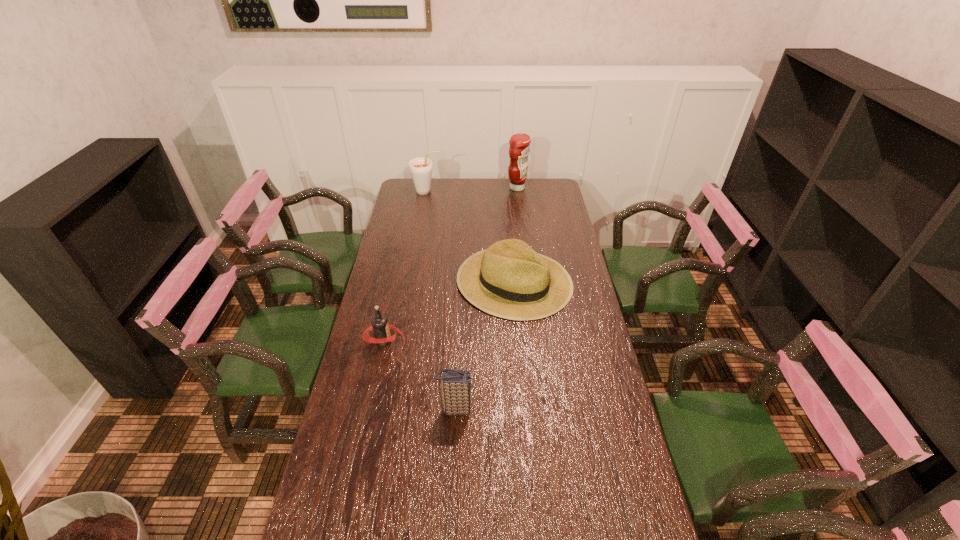
Where is `vacant space in between the shorter root beer and the sunhat`? The width and height of the screenshot is (960, 540). vacant space in between the shorter root beer and the sunhat is located at coordinates (449, 312).

Locate an element on the screen. empty space between the second tallest object and the clutch bag is located at coordinates (442, 300).

I want to click on vacant point located between the nearest object and the nearer root beer, so click(420, 375).

Image resolution: width=960 pixels, height=540 pixels. Identify the location of blank region between the farther root beer and the clutch bag. (442, 300).

Locate an element on the screen. free space between the sunhat and the second nearest object is located at coordinates (449, 312).

Image resolution: width=960 pixels, height=540 pixels. In order to click on the closest object relative to the third nearest object in this screenshot , I will do `click(380, 326)`.

Find the location of a particular element. The width and height of the screenshot is (960, 540). object that is the third closest to the tallest object is located at coordinates tap(380, 326).

You are a GUI agent. You are given a task and a screenshot of the screen. Output one action in this format:
    pyautogui.click(x=<x>, y=<y>)
    Task: Click on the blank space that satisfies the following two spatial constraints: 1. on the front side of the condiment; 2. on the label of the shorter root beer
    The height and width of the screenshot is (540, 960).
    Given the screenshot: What is the action you would take?
    pyautogui.click(x=537, y=341)

What are the coordinates of `free space in the image that satisfies the following two spatial constraints: 1. on the front side of the condiment; 2. with the zip open on the clutch bag` in the screenshot? It's located at (545, 409).

Locate an element on the screen. The image size is (960, 540). free space that satisfies the following two spatial constraints: 1. on the back side of the third nearest object; 2. on the drink side of the farther root beer is located at coordinates (507, 192).